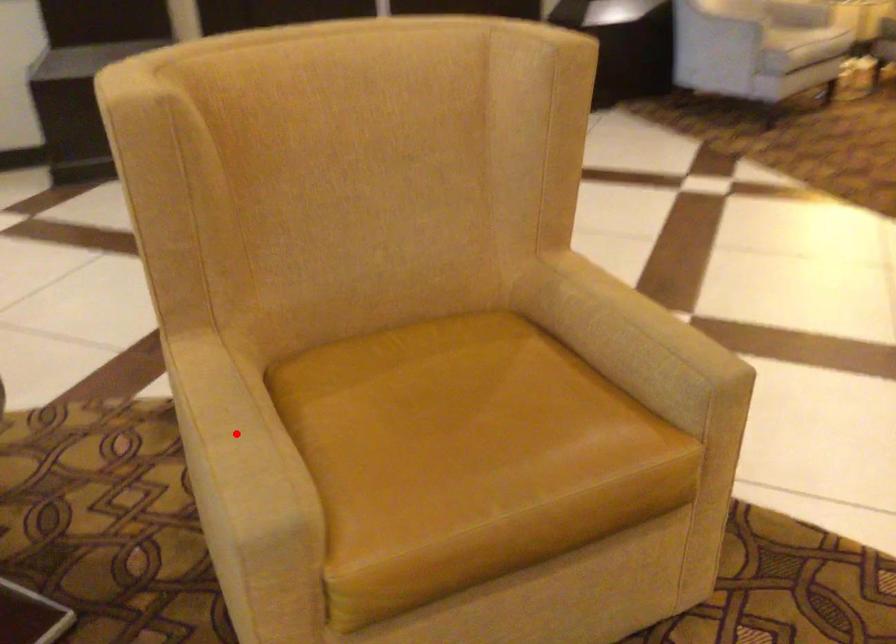
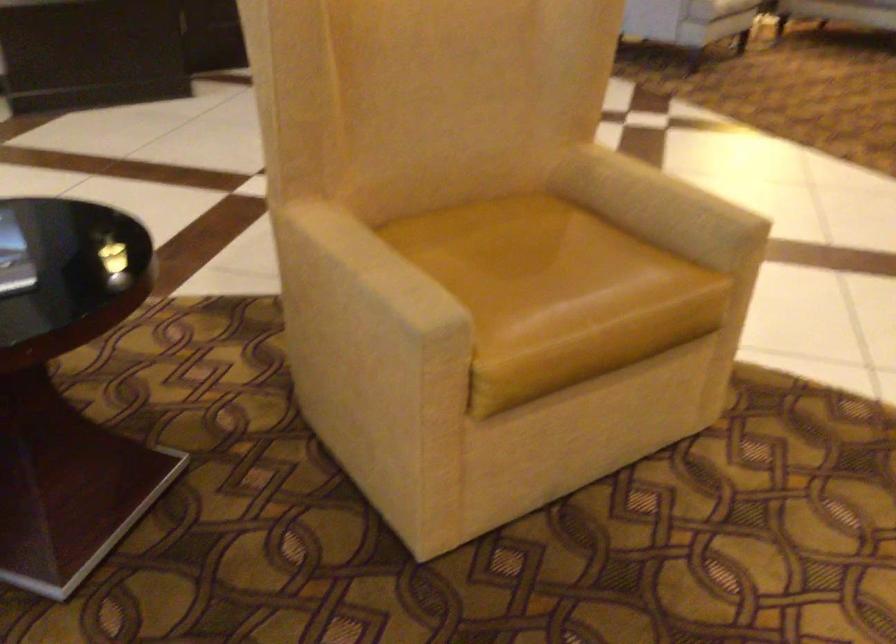
Question: A red point is marked in image1. In image2, is the corresponding 3D point closer to the camera or farther? Reply with the corresponding letter.

Choices:
 (A) The corresponding 3D point is closer.
 (B) The corresponding 3D point is farther.

Answer: (B)